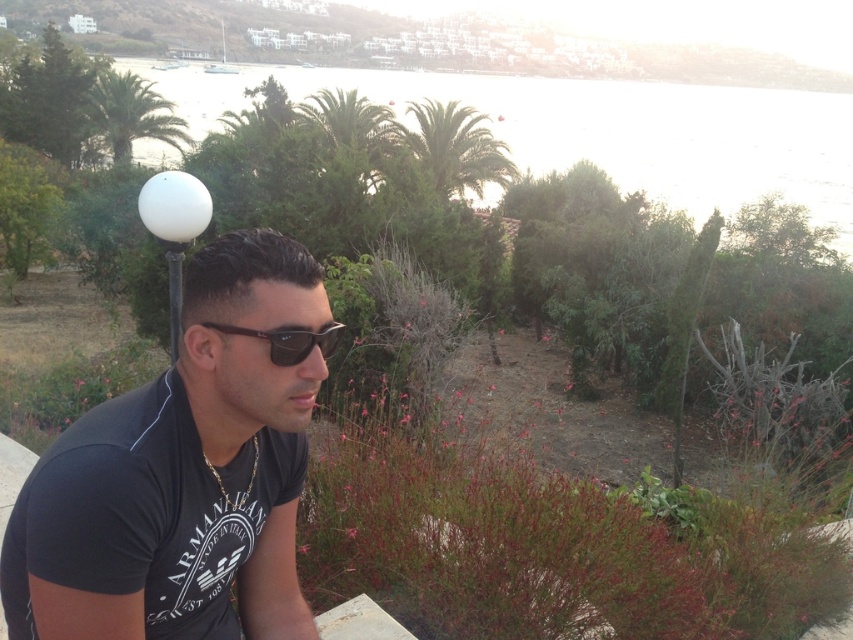
Question: Does black matte t-shirt at left appear under black plastic sunglasses at center?

Choices:
 (A) no
 (B) yes

Answer: (B)

Question: Does black matte t-shirt at left have a smaller size compared to black plastic sunglasses at center?

Choices:
 (A) no
 (B) yes

Answer: (A)

Question: Which point appears farthest from the camera in this image?

Choices:
 (A) (282, 364)
 (B) (305, 614)

Answer: (B)

Question: Does black matte t-shirt at left have a greater width compared to black plastic sunglasses at center?

Choices:
 (A) yes
 (B) no

Answer: (A)

Question: Which object appears closest to the camera in this image?

Choices:
 (A) black matte t-shirt at left
 (B) black plastic sunglasses at center

Answer: (A)

Question: Which of the following is the farthest from the observer?

Choices:
 (A) (260, 500)
 (B) (325, 333)

Answer: (A)